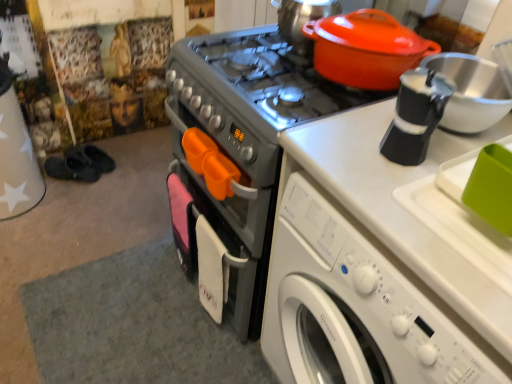
The image size is (512, 384). In order to click on metallic gray stove at center in this screenshot , I will do `click(236, 157)`.

In order to click on white plastic washing machine at lower right in this screenshot , I will do `click(357, 304)`.

Between white plastic washing machine at lower right and matte orange pot at upper right, which one is positioned in front?

white plastic washing machine at lower right is in front.

Which of these two, white plastic washing machine at lower right or matte orange pot at upper right, is smaller?

Smaller between the two is matte orange pot at upper right.

From the picture: Which object is thinner, white plastic washing machine at lower right or matte orange pot at upper right?

With smaller width is matte orange pot at upper right.

Is white plastic washing machine at lower right further to camera compared to metallic gray stove at center?

No.

Could metallic gray stove at center be considered to be inside white plastic washing machine at lower right?

Definitely not — metallic gray stove at center is not inside white plastic washing machine at lower right.

Which of these two, matte orange tea pot at upper right or metallic gray stove at center, is wider?

metallic gray stove at center.

Does matte orange tea pot at upper right touch metallic gray stove at center?

matte orange tea pot at upper right is not next to metallic gray stove at center, and they're not touching.

Can you tell me how much matte orange tea pot at upper right and metallic gray stove at center differ in facing direction?

0.232 degrees separate the facing orientations of matte orange tea pot at upper right and metallic gray stove at center.

How much distance is there between metallic gray stove at center and white plastic washing machine at lower right?

metallic gray stove at center and white plastic washing machine at lower right are 11.79 inches apart from each other.

This screenshot has width=512, height=384. I want to click on home appliance behind the white plastic washing machine at lower right, so click(236, 157).

Between metallic gray stove at center and white plastic washing machine at lower right, which one has larger width?

white plastic washing machine at lower right.

From a real-world perspective, is metallic gray stove at center physically located above or below white plastic washing machine at lower right?

metallic gray stove at center is above white plastic washing machine at lower right.

Locate an element on the screen. The image size is (512, 384). tea pot that appears on the left of matte orange pot at upper right is located at coordinates (302, 20).

Which is correct: matte orange tea pot at upper right is inside matte orange pot at upper right, or outside of it?

matte orange tea pot at upper right is not enclosed by matte orange pot at upper right.

Which point is more forward, (302,1) or (385,32)?

The point (385,32) is closer.

Is matte orange tea pot at upper right oriented towards matte orange pot at upper right?

No.

From a real-world perspective, is metallic gray stove at center positioned above or below matte orange pot at upper right?

From a real-world perspective, metallic gray stove at center is physically below matte orange pot at upper right.

At what (x,y) coordinates should I click in order to perform the action: click on home appliance in front of the matte orange pot at upper right. Please return your answer as a coordinate pair (x, y). The width and height of the screenshot is (512, 384). Looking at the image, I should click on (236, 157).

Is metallic gray stove at center next to matte orange pot at upper right and touching it?

metallic gray stove at center is not next to matte orange pot at upper right, and they're not touching.

Is point (220, 144) closer or farther from the camera than point (325, 65)?

Clearly, point (220, 144) is more distant from the camera than point (325, 65).

Based on their positions, is metallic gray stove at center located to the left or right of matte orange tea pot at upper right?

In the image, metallic gray stove at center appears on the left side of matte orange tea pot at upper right.

Are metallic gray stove at center and matte orange tea pot at upper right beside each other?

No, metallic gray stove at center is not next to matte orange tea pot at upper right.

Is matte orange tea pot at upper right a part of metallic gray stove at center?

No, metallic gray stove at center does not contain matte orange tea pot at upper right.

In the image, there is a white plastic washing machine at lower right. What are the coordinates of `kitchen appliance above it (from the image's perspective)` in the screenshot? It's located at (366, 49).

Where is `washing machine that is on the right side of metallic gray stove at center`? washing machine that is on the right side of metallic gray stove at center is located at coordinates (357, 304).

From the image, which object appears to be farther from matte orange tea pot at upper right, metallic gray stove at center or white plastic washing machine at lower right?

The object further to matte orange tea pot at upper right is white plastic washing machine at lower right.

From the picture: Based on their spatial positions, is matte orange pot at upper right or matte orange tea pot at upper right further from metallic gray stove at center?

Based on the image, matte orange tea pot at upper right appears to be further to metallic gray stove at center.

Looking at the image, which one is located further to white plastic washing machine at lower right, matte orange tea pot at upper right or matte orange pot at upper right?

matte orange tea pot at upper right.

Based on their spatial positions, is white plastic washing machine at lower right or metallic gray stove at center further from matte orange pot at upper right?

white plastic washing machine at lower right is positioned further to the anchor matte orange pot at upper right.

When comparing their distances from matte orange pot at upper right, does white plastic washing machine at lower right or matte orange tea pot at upper right seem further?

Among the two, white plastic washing machine at lower right is located further to matte orange pot at upper right.

Looking at the image, which one is located further to white plastic washing machine at lower right, metallic gray stove at center or matte orange pot at upper right?

Based on the image, matte orange pot at upper right appears to be further to white plastic washing machine at lower right.

Estimate the real-world distances between objects in this image. Which object is further from matte orange pot at upper right, metallic gray stove at center or matte orange tea pot at upper right?

metallic gray stove at center is further to matte orange pot at upper right.

Consider the image. Based on their spatial positions, is matte orange pot at upper right or metallic gray stove at center further from white plastic washing machine at lower right?

matte orange pot at upper right is further to white plastic washing machine at lower right.

You are a GUI agent. You are given a task and a screenshot of the screen. Output one action in this format:
    pyautogui.click(x=<x>, y=<y>)
    Task: Click on the kitchen appliance that lies between matte orange tea pot at upper right and white plastic washing machine at lower right from top to bottom
    
    Given the screenshot: What is the action you would take?
    pyautogui.click(x=366, y=49)

Locate an element on the screen. This screenshot has height=384, width=512. home appliance between matte orange pot at upper right and white plastic washing machine at lower right in the vertical direction is located at coordinates (236, 157).

Locate an element on the screen. kitchen appliance between matte orange tea pot at upper right and metallic gray stove at center in the vertical direction is located at coordinates (366, 49).

Find the location of a particular element. This screenshot has width=512, height=384. home appliance between matte orange tea pot at upper right and white plastic washing machine at lower right in the vertical direction is located at coordinates (236, 157).